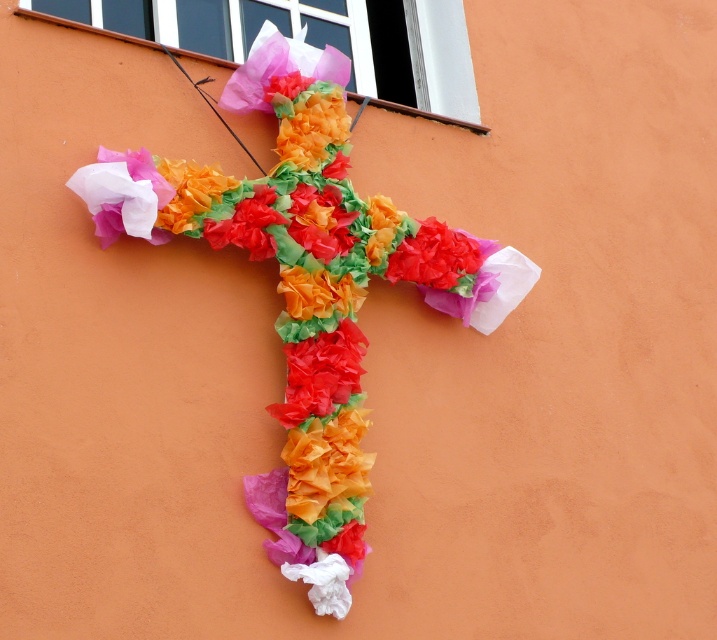
Question: Considering the relative positions of tissue paper cross at center and matte paper flower at center in the image provided, where is tissue paper cross at center located with respect to matte paper flower at center?

Choices:
 (A) left
 (B) right

Answer: (A)

Question: Among these points, which one is nearest to the camera?

Choices:
 (A) (460, 252)
 (B) (282, 67)

Answer: (B)

Question: Which point is farther from the camera taking this photo?

Choices:
 (A) (446, 285)
 (B) (132, 184)

Answer: (A)

Question: From the image, what is the correct spatial relationship of tissue paper cross at center in relation to matte paper flower at center?

Choices:
 (A) left
 (B) right

Answer: (A)

Question: Is tissue paper cross at center further to camera compared to matte paper flower at center?

Choices:
 (A) yes
 (B) no

Answer: (B)

Question: Which point appears closest to the camera in this image?

Choices:
 (A) (294, 554)
 (B) (422, 259)

Answer: (A)